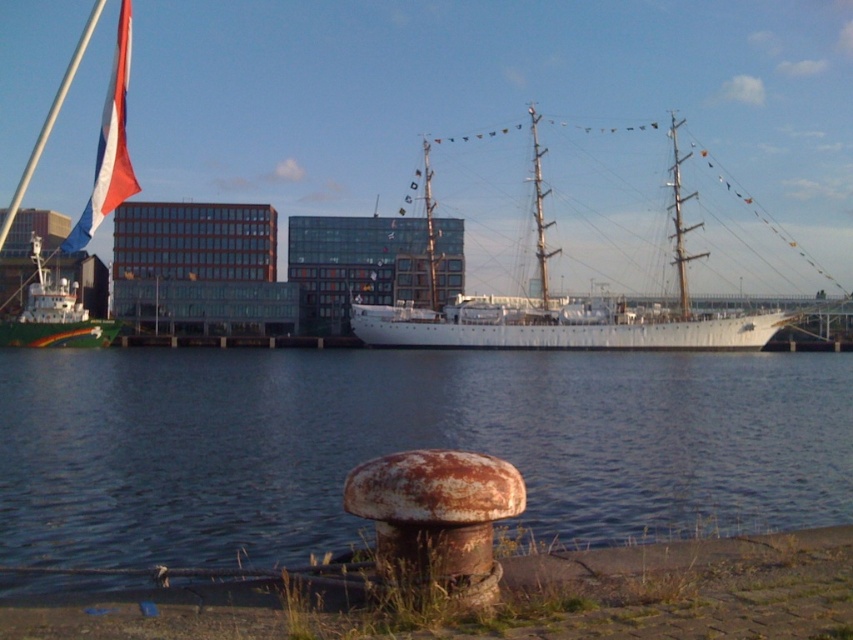
Describe the element at coordinates (404, 445) in the screenshot. I see `rusty metallic water at lower center` at that location.

Can you confirm if rusty metallic water at lower center is positioned below white glossy ship at left?

Yes, rusty metallic water at lower center is below white glossy ship at left.

What do you see at coordinates (404, 445) in the screenshot? I see `rusty metallic water at lower center` at bounding box center [404, 445].

I want to click on rusty metallic water at lower center, so click(x=404, y=445).

Is rusty metallic water at lower center to the left of white polished wood ship at center from the viewer's perspective?

Indeed, rusty metallic water at lower center is positioned on the left side of white polished wood ship at center.

Is point (554, 413) behind point (398, 340)?

No.

Where is `rusty metallic water at lower center`? rusty metallic water at lower center is located at coordinates (404, 445).

Which is more to the right, red-white-blue fabric flag at upper left or white glossy ship at left?

Positioned to the right is white glossy ship at left.

Is red-white-blue fabric flag at upper left behind white glossy ship at left?

That is False.

Image resolution: width=853 pixels, height=640 pixels. Identify the location of red-white-blue fabric flag at upper left. (109, 145).